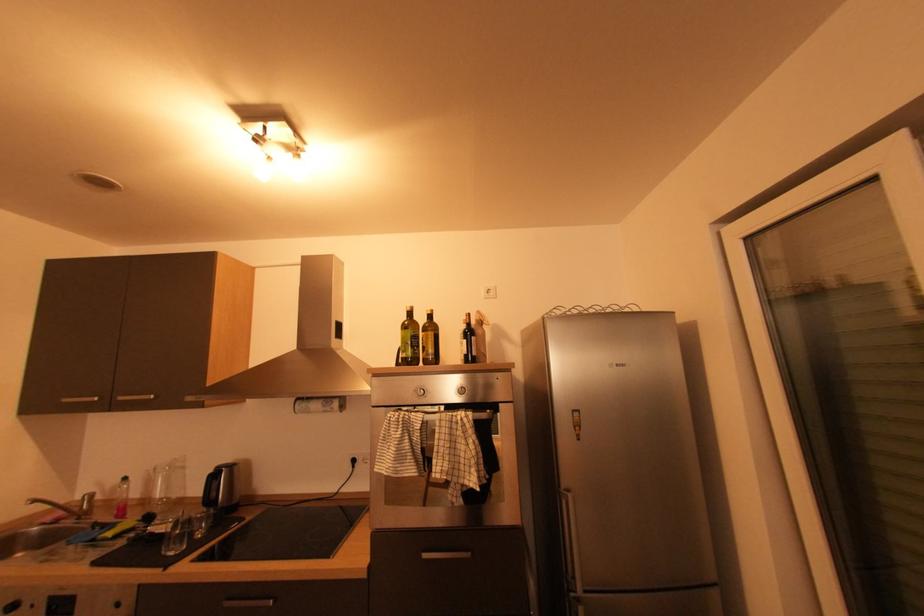
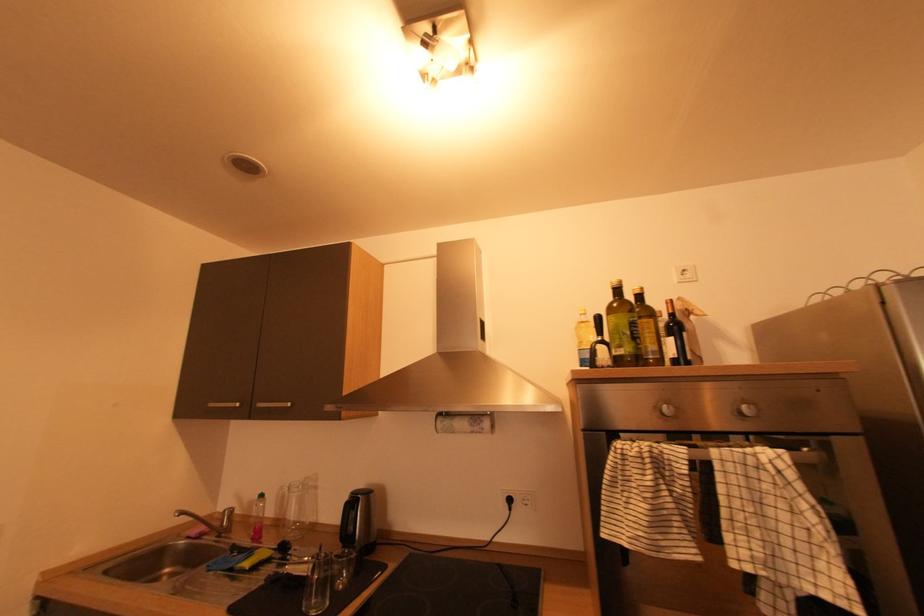
The images are taken continuously from a first-person perspective. In which direction are you moving?

Answer: The cameraman walked toward left, forward.